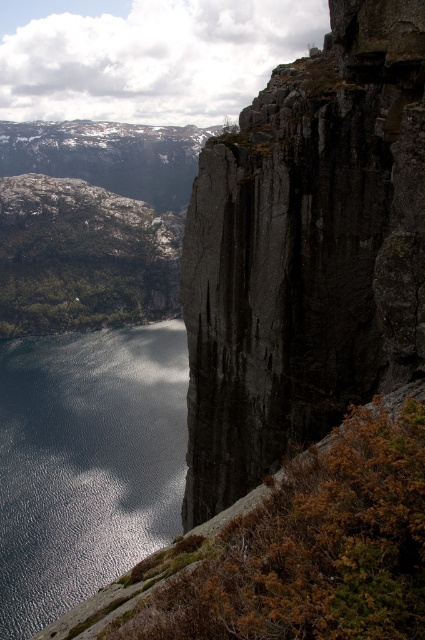
Can you confirm if glistening reflective water at lower left is thinner than brown grassy hillside at lower left?

Incorrect, glistening reflective water at lower left's width is not less than brown grassy hillside at lower left's.

Is point (22, 465) positioned in front of point (255, 492)?

No, it is behind (255, 492).

You are a GUI agent. You are given a task and a screenshot of the screen. Output one action in this format:
    pyautogui.click(x=<x>, y=<y>)
    Task: Click on the glistening reflective water at lower left
    The width and height of the screenshot is (425, 640).
    Given the screenshot: What is the action you would take?
    point(87,461)

Which of these two, dark gray rock face at upper right or glistening reflective water at lower left, stands taller?

With more height is dark gray rock face at upper right.

Is dark gray rock face at upper right further to the viewer compared to glistening reflective water at lower left?

No, dark gray rock face at upper right is in front of glistening reflective water at lower left.

Image resolution: width=425 pixels, height=640 pixels. I want to click on dark gray rock face at upper right, so click(306, 252).

At what (x,y) coordinates should I click in order to perform the action: click on dark gray rock face at upper right. Please return your answer as a coordinate pair (x, y). The width and height of the screenshot is (425, 640). Looking at the image, I should click on (306, 252).

Can you confirm if dark gray rock face at upper right is positioned to the right of brown grassy hillside at lower left?

Indeed, dark gray rock face at upper right is positioned on the right side of brown grassy hillside at lower left.

In the scene shown: Is dark gray rock face at upper right shorter than brown grassy hillside at lower left?

Incorrect, dark gray rock face at upper right's height does not fall short of brown grassy hillside at lower left's.

The width and height of the screenshot is (425, 640). What do you see at coordinates (306, 252) in the screenshot?
I see `dark gray rock face at upper right` at bounding box center [306, 252].

Where is `dark gray rock face at upper right`? The image size is (425, 640). dark gray rock face at upper right is located at coordinates (306, 252).